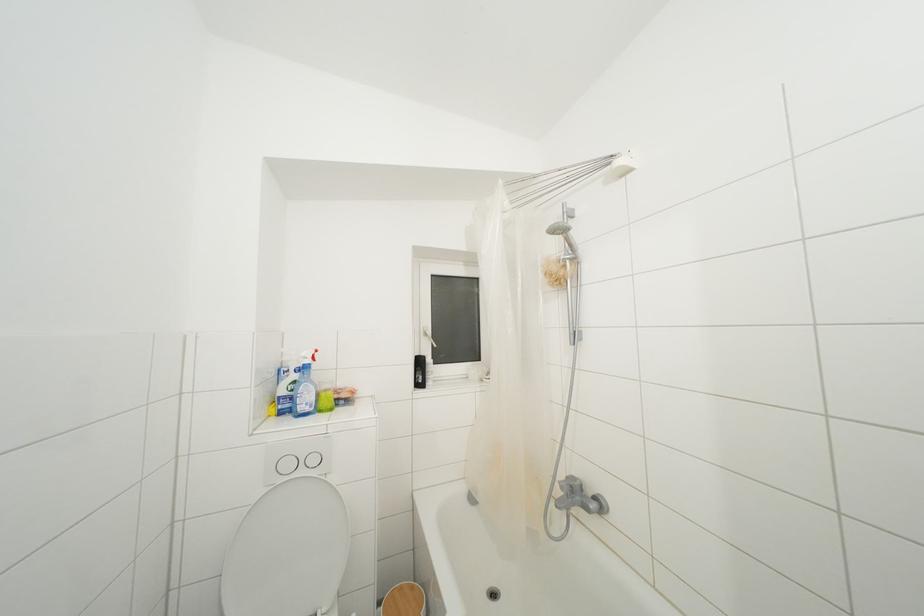
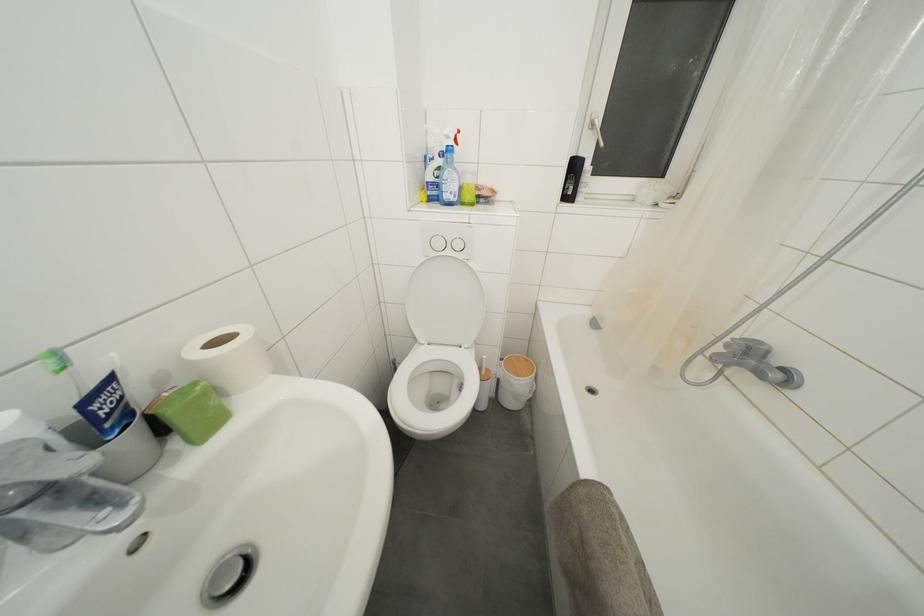
The point at (307, 360) is marked in the first image. Where is the corresponding point in the second image?

(450, 138)